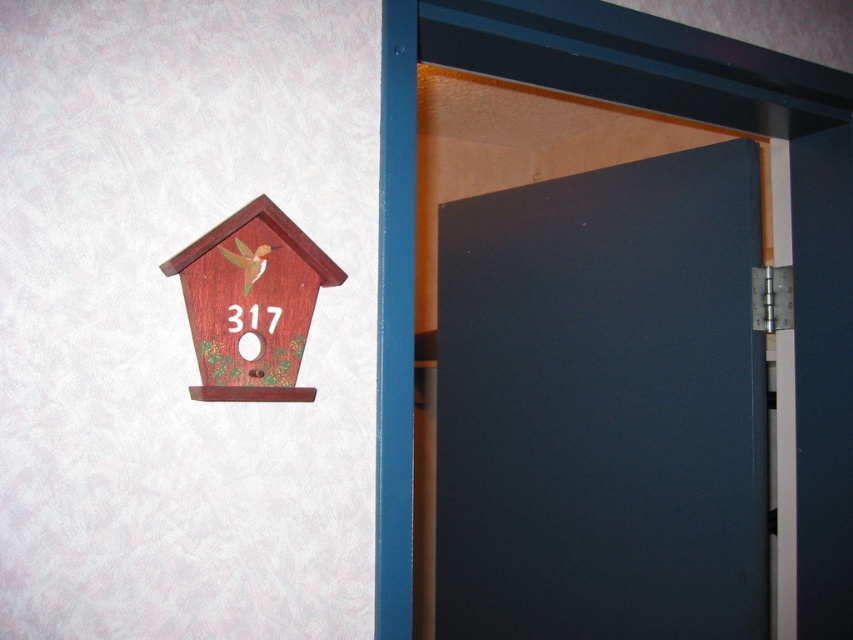
Between dark blue matte door at center and wooden birdhouse at left, which one is positioned lower?

dark blue matte door at center is lower down.

Can you confirm if dark blue matte door at center is positioned to the right of wooden birdhouse at left?

Indeed, dark blue matte door at center is positioned on the right side of wooden birdhouse at left.

Locate an element on the screen. This screenshot has height=640, width=853. dark blue matte door at center is located at coordinates (602, 404).

Does wooden birdhouse at left appear on the left side of wooden hummingbird at upper left?

In fact, wooden birdhouse at left is to the right of wooden hummingbird at upper left.

At what (x,y) coordinates should I click in order to perform the action: click on wooden birdhouse at left. Please return your answer as a coordinate pair (x, y). Image resolution: width=853 pixels, height=640 pixels. Looking at the image, I should click on (251, 301).

This screenshot has width=853, height=640. In order to click on wooden birdhouse at left in this screenshot , I will do `click(251, 301)`.

Image resolution: width=853 pixels, height=640 pixels. Find the location of `wooden birdhouse at left`. wooden birdhouse at left is located at coordinates (251, 301).

Between dark blue matte door at center and wooden hummingbird at upper left, which one has more height?

dark blue matte door at center

Is point (534, 435) positioned behind point (263, 244)?

Yes.

Between point (590, 616) and point (241, 248), which one is positioned in front?

Positioned in front is point (241, 248).

Image resolution: width=853 pixels, height=640 pixels. Identify the location of dark blue matte door at center. (602, 404).